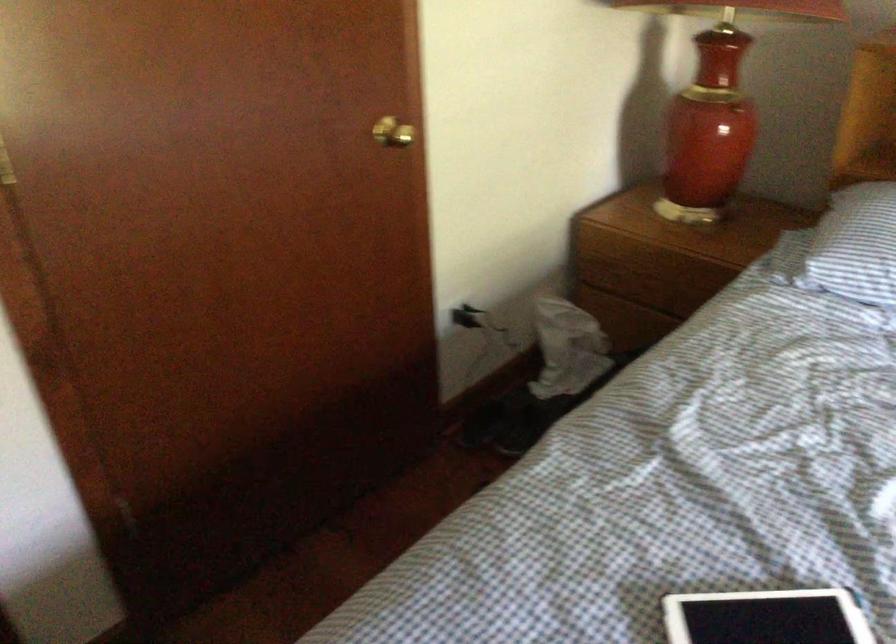
The image size is (896, 644). What do you see at coordinates (392, 133) in the screenshot? I see `a gold doorknob` at bounding box center [392, 133].